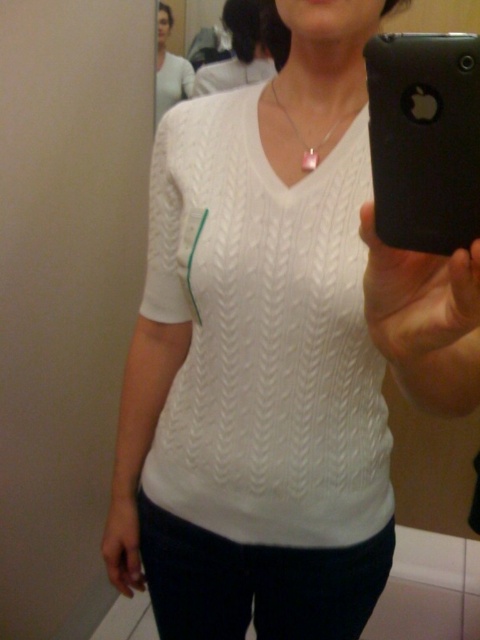
Question: Does white knitted sweater at upper center come behind pink glass pendant at center?

Choices:
 (A) no
 (B) yes

Answer: (B)

Question: Which of the following is the closest to the observer?

Choices:
 (A) (168, 83)
 (B) (300, 140)
 (C) (463, 116)

Answer: (C)

Question: Estimate the real-world distances between objects in this image. Which object is closer to the pink glass pendant at center?

Choices:
 (A) black plastic phone at upper right
 (B) white knitted shirt at center

Answer: (B)

Question: Which point is farther from the camera taking this photo?

Choices:
 (A) (170, 58)
 (B) (399, 48)
 (C) (304, 163)
 (D) (192, 397)

Answer: (A)

Question: Is the position of white knitted shirt at center more distant than that of black plastic phone at upper right?

Choices:
 (A) yes
 (B) no

Answer: (A)

Question: Does white knitted shirt at center have a smaller size compared to black plastic phone at upper right?

Choices:
 (A) yes
 (B) no

Answer: (B)